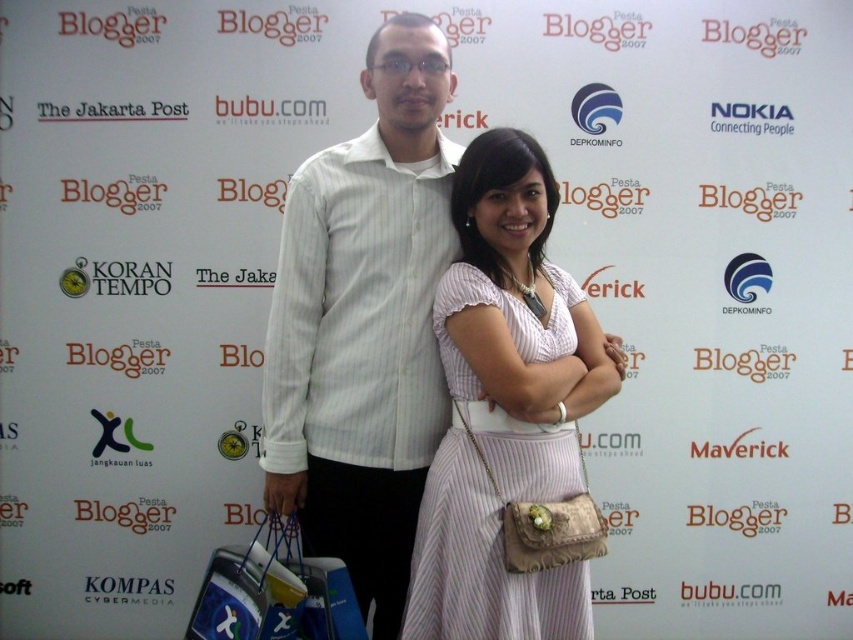
You are standing in front of the Pesta Blogger 2007 backdrop and notice two points marked on it. The points are labeled as point 1 at coordinates (428, 326) and point 2 at (349, 614). Which point is closer to you?

Point 1 at coordinates (428, 326) is closer to you because it is further to the viewer than point 2 at (349, 614).

You are a photographer taking a picture of the white striped shirt at center and the blue fabric shopping bag at lower left. Which object is closer to the camera?

The white striped shirt at center is closer to the camera because the blue fabric shopping bag at lower left is behind it.